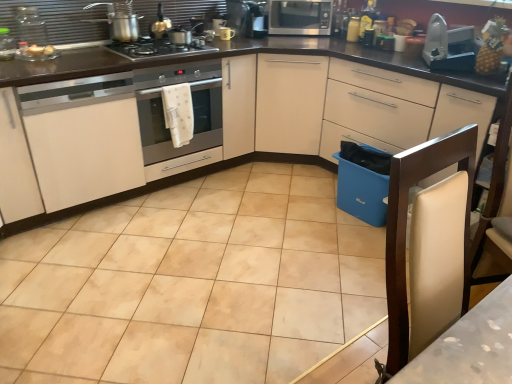
The image size is (512, 384). Find the location of `vacant space underneath metallic silver kettle at upper center, arranged as the fifth appliance when viewed from the right (from a real-world perspective)`. vacant space underneath metallic silver kettle at upper center, arranged as the fifth appliance when viewed from the right (from a real-world perspective) is located at coordinates (160, 38).